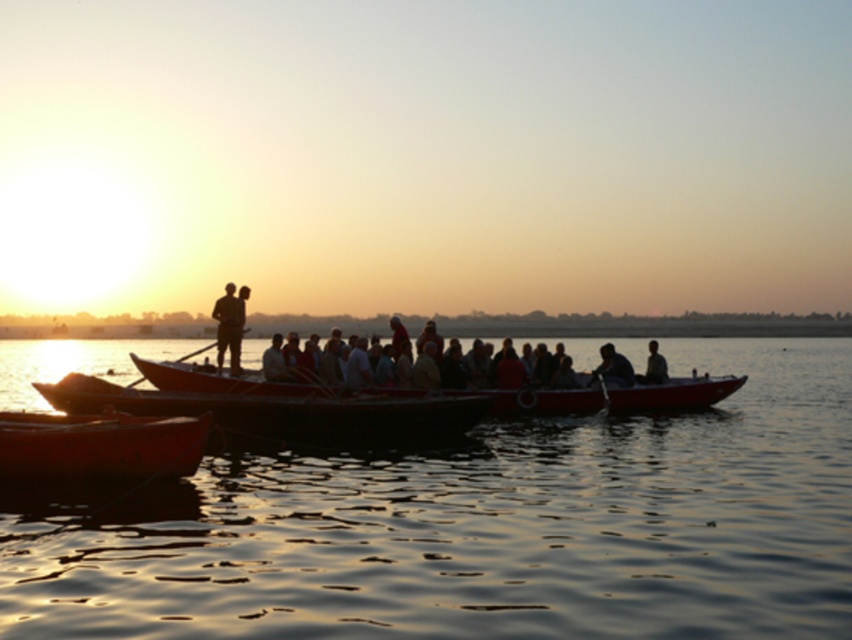
You are a photographer trying to capture the sunset reflection on the water. You are standing at the lower left corner of the image. Which boat, the smooth wood canoe at lower left or the silvery metallic boat at center, is closer to you?

The smooth wood canoe at lower left is closer to you since it is in front of the silvery metallic boat at center.

You are standing at the center of the image and want to walk towards the smooth wood canoe at lower left. In which direction should you move?

You should move towards the lower left direction to reach the smooth wood canoe at lower left, as its 2D location is at point [96,448].

You are a photographer trying to capture the sunset reflection on the water. You want to ensure that both the smooth wood canoe at lower left and the silvery metallic boat at center are visible in your shot. Based on their positions, which boat should you focus on to include both in the frame?

The smooth wood canoe at lower left is located below the silvery metallic boat at center, so focusing on the silvery metallic boat at center will allow both boats to be visible in the frame since the canoe is positioned lower in the image.